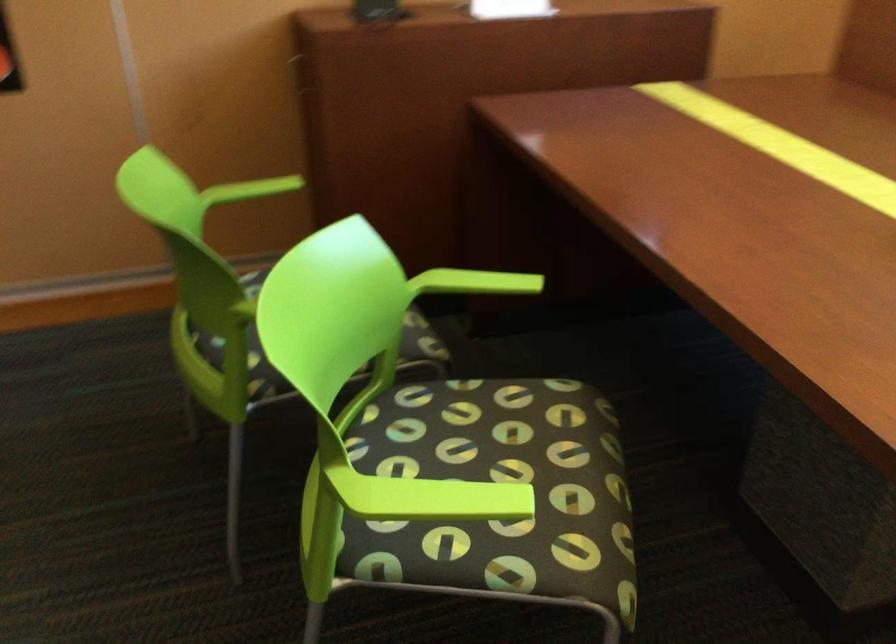
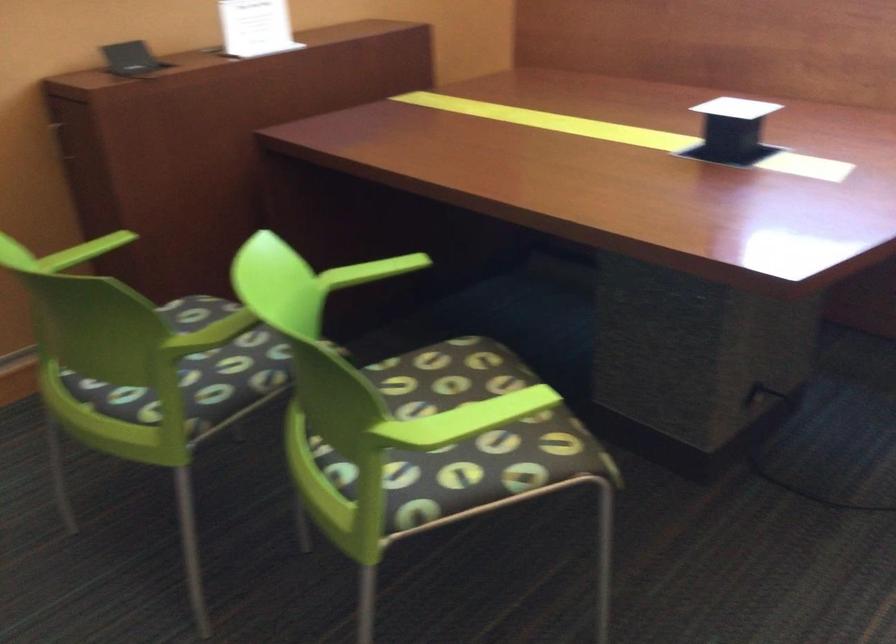
Question: The camera is either moving clockwise (left) or counter-clockwise (right) around the object. The first image is from the beginning of the video and the second image is from the end. Is the camera moving left or right when shooting the video?

Choices:
 (A) Left
 (B) Right

Answer: (A)